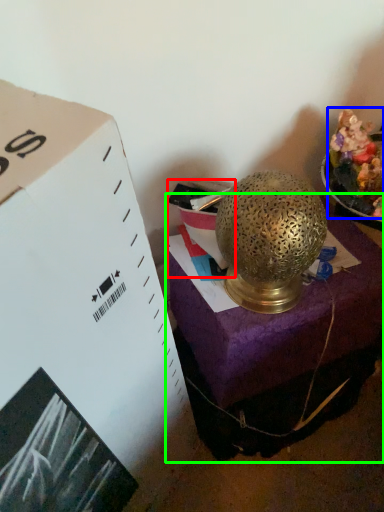
Question: Estimate the real-world distances between objects in this image. Which object is farther from box (highlighted by a red box), food (highlighted by a blue box) or furniture (highlighted by a green box)?

Choices:
 (A) food
 (B) furniture

Answer: (B)